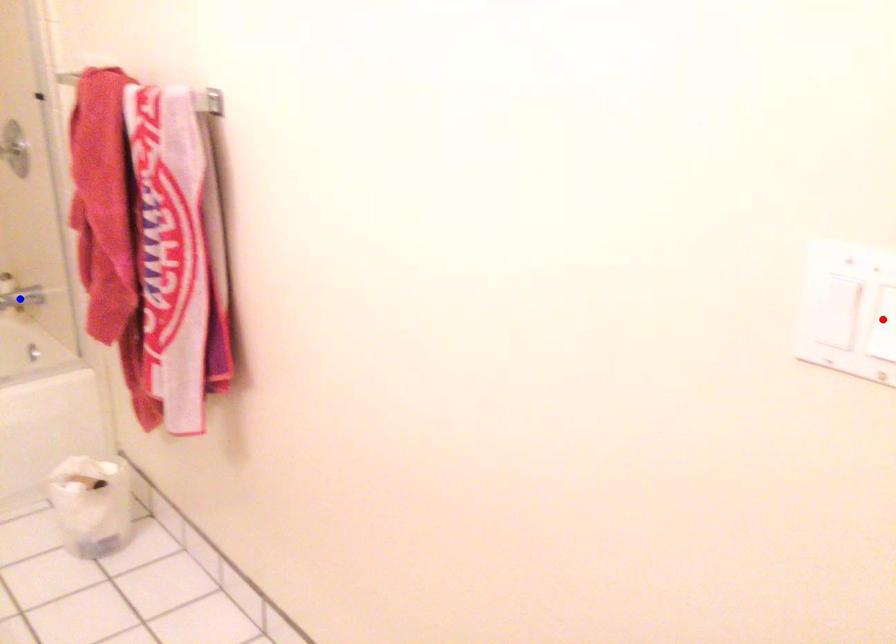
Question: Two points are marked on the image. Which point is closer to the camera?

Choices:
 (A) Blue point is closer.
 (B) Red point is closer.

Answer: (B)